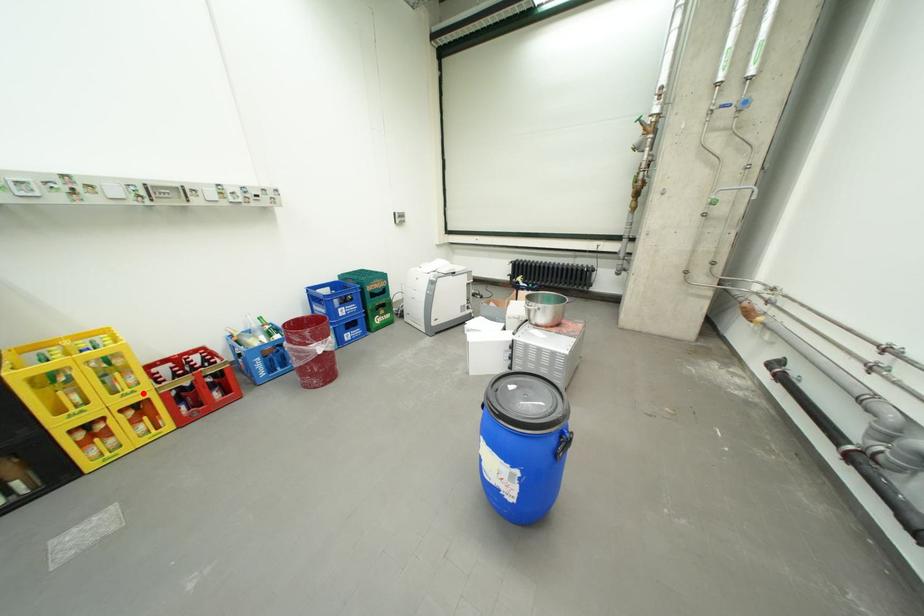
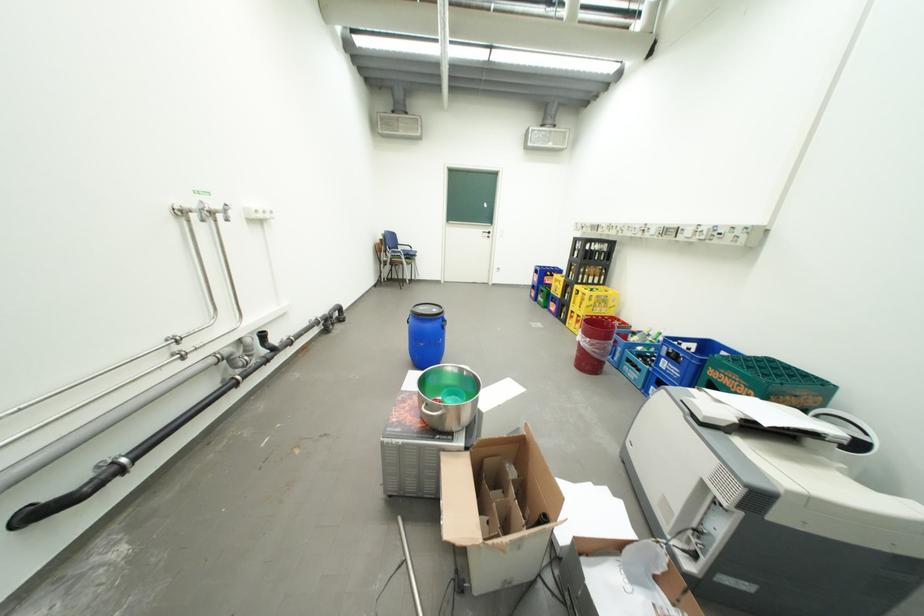
Question: I am providing you with two images of the same scene from different viewpoints. A red point is marked on the first image. Is the red point's position out of view in image 2?

Choices:
 (A) Yes
 (B) No

Answer: (B)